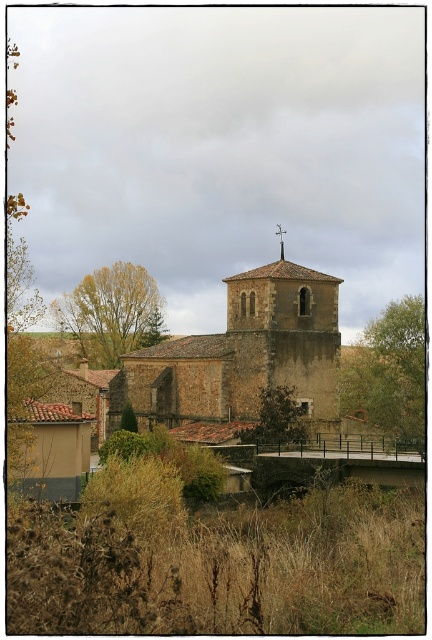
Question: Which of the following is the closest to the observer?

Choices:
 (A) brown textured tree at center
 (B) yellow-green leaves at left
 (C) green leafy tree at upper center
 (D) brown stone church tower at center

Answer: (C)

Question: Which object appears farthest from the camera in this image?

Choices:
 (A) yellow-green leaves at left
 (B) brown textured tree at center

Answer: (A)

Question: Is green leafy tree at upper center positioned in front of brown textured tree at center?

Choices:
 (A) no
 (B) yes

Answer: (B)

Question: Can you confirm if green leafy tree at upper center is smaller than brown textured tree at center?

Choices:
 (A) no
 (B) yes

Answer: (A)

Question: Which of the following is the farthest from the observer?

Choices:
 (A) (387, 378)
 (B) (82, 320)

Answer: (B)

Question: From the image, what is the correct spatial relationship of brown stone church tower at center in relation to brown textured tree at center?

Choices:
 (A) right
 (B) left

Answer: (A)